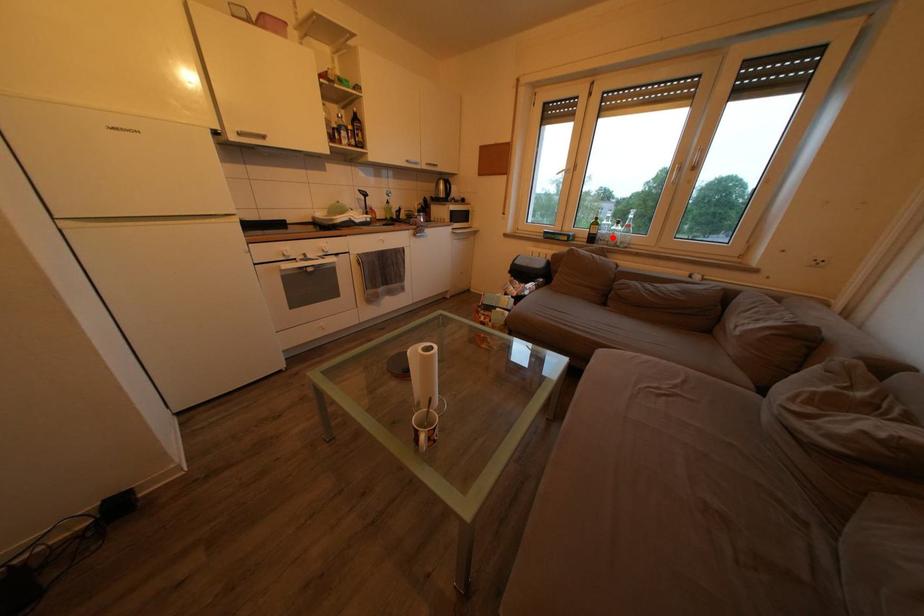
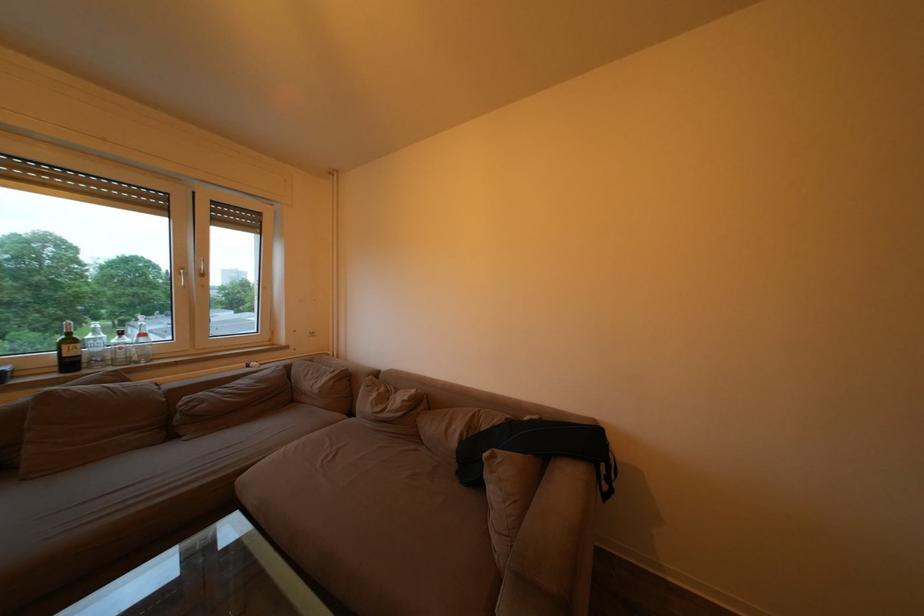
In the second image, find the point that corresponds to the highlighted location in the first image.

(107, 355)